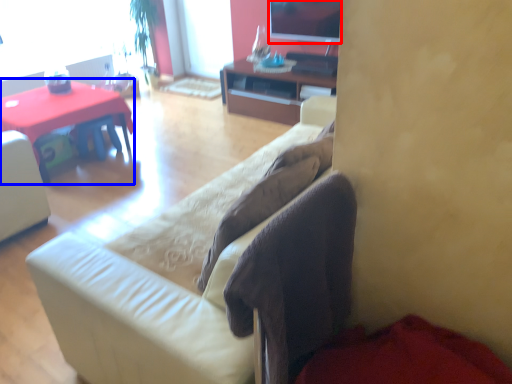
Question: Which of the following is the farthest to the observer, television (highlighted by a red box) or desk (highlighted by a blue box)?

Choices:
 (A) television
 (B) desk

Answer: (A)